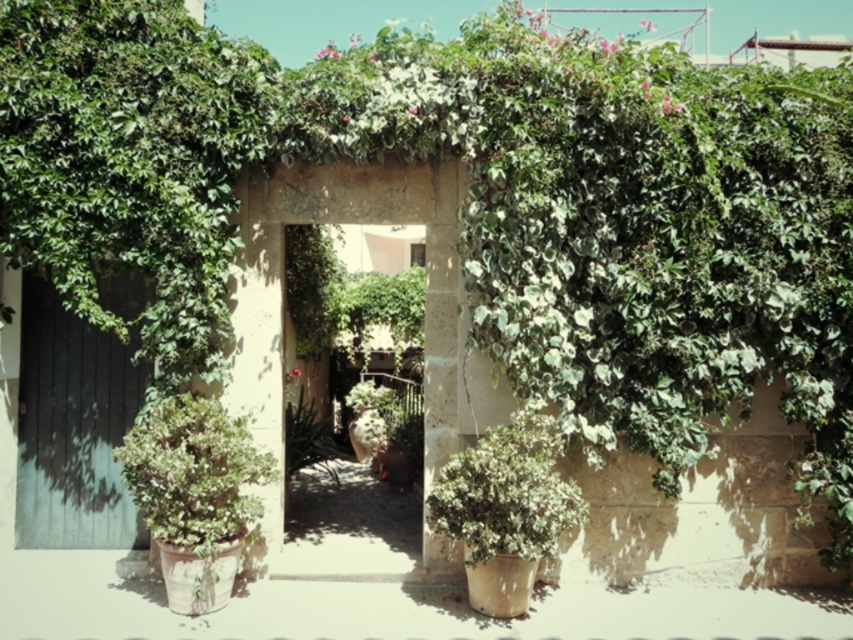
You are standing in front of the stone archway and want to enter through the dark wood door at left. Can you step over the green matte potted plant at left to reach the door?

The dark wood door at left is positioned over the green matte potted plant at left, meaning the door is elevated above the potted plant. To reach the door, you would need to step up onto the higher level where the door is located rather than stepping over the potted plant itself.

You are standing in front of the stone archway and need to determine which object is taller between the dark wood door at left and the green matte potted plant at left. Can you identify the taller object?

The dark wood door at left is taller than the green matte potted plant at left.

You are a gardener who wants to place a new small statue between the green leafy archway at center and the green matte plant at center. Which side of the archway should you place it so it doesn

The green leafy archway at center is larger in size than the green matte plant at center, so placing the statue closer to the green matte plant at center would create a balanced composition.